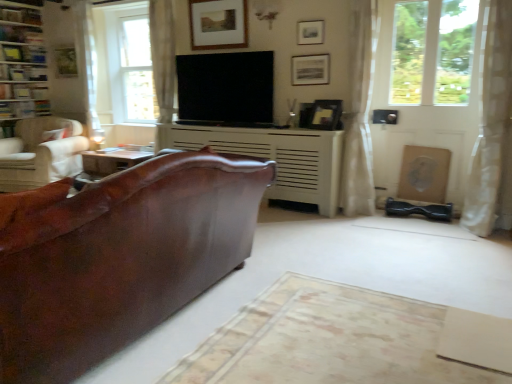
Question: Considering the relative sizes of matte gold picture frame at upper left, which is the 1th picture frame in left-to-right order, and brown leather couch at center in the image provided, is matte gold picture frame at upper left, which is the 1th picture frame in left-to-right order, thinner than brown leather couch at center?

Choices:
 (A) no
 (B) yes

Answer: (B)

Question: Considering the relative sizes of matte gold picture frame at upper left, which is counted as the fourth picture frame, starting from the front, and brown leather couch at center in the image provided, is matte gold picture frame at upper left, which is counted as the fourth picture frame, starting from the front, shorter than brown leather couch at center?

Choices:
 (A) yes
 (B) no

Answer: (A)

Question: Considering the relative positions of matte gold picture frame at upper left, which is the 1th picture frame in left-to-right order, and brown leather couch at center in the image provided, is matte gold picture frame at upper left, which is the 1th picture frame in left-to-right order, to the left of brown leather couch at center from the viewer's perspective?

Choices:
 (A) yes
 (B) no

Answer: (A)

Question: Is matte gold picture frame at upper left, marked as the 1th picture frame in a back-to-front arrangement, aimed at brown leather couch at center?

Choices:
 (A) yes
 (B) no

Answer: (B)

Question: Is matte gold picture frame at upper left, which is counted as the fourth picture frame, starting from the front, closer to camera compared to brown leather couch at center?

Choices:
 (A) yes
 (B) no

Answer: (B)

Question: Does matte black picture frame at upper center, the 1th picture frame when ordered from right to left, have a greater width compared to matte black picture frame at upper center, which ranks as the 3th picture frame in left-to-right order?

Choices:
 (A) yes
 (B) no

Answer: (A)

Question: Would you say matte black picture frame at upper center, the 4th picture frame viewed from the back, is part of matte black picture frame at upper center, the 4th picture frame in the left-to-right sequence,'s contents?

Choices:
 (A) yes
 (B) no

Answer: (B)

Question: From a real-world perspective, is matte black picture frame at upper center, which is the second picture frame in front-to-back order, below matte black picture frame at upper center, which ranks as the 3th picture frame in left-to-right order?

Choices:
 (A) yes
 (B) no

Answer: (A)

Question: Is matte black picture frame at upper center, placed as the third picture frame when sorted from back to front, to the right of matte black picture frame at upper center, which ranks as the 3th picture frame in left-to-right order, from the viewer's perspective?

Choices:
 (A) no
 (B) yes

Answer: (B)

Question: Is matte black picture frame at upper center, the 1th picture frame when ordered from right to left, further to the viewer compared to matte black picture frame at upper center, which ranks as the 3th picture frame in left-to-right order?

Choices:
 (A) yes
 (B) no

Answer: (A)

Question: Is matte black picture frame at upper center, which is the second picture frame in front-to-back order, positioned far away from matte black picture frame at upper center, the first picture frame from the front?

Choices:
 (A) yes
 (B) no

Answer: (B)

Question: Is brown leather couch at center to the right of matte wooden picture frame at upper center, the third picture frame positioned from the front, from the viewer's perspective?

Choices:
 (A) no
 (B) yes

Answer: (A)